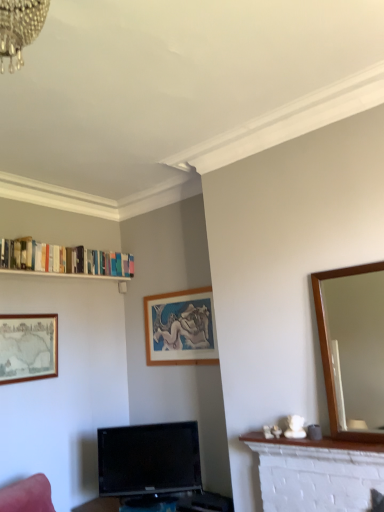
In order to face wooden picture frame at center, which is counted as the second picture frame, starting from the left, should I rotate leftwards or rightwards?

Rotate left and turn 1.717 degrees.

Find the location of a particular element. gold-framed map at left, the 2th picture frame when ordered from right to left is located at coordinates (28, 347).

Describe the element at coordinates (316, 473) in the screenshot. I see `white brick fireplace at lower right` at that location.

The height and width of the screenshot is (512, 384). Describe the element at coordinates (149, 461) in the screenshot. I see `black glossy tv at lower center` at that location.

Find the location of a particular element. wooden picture frame at center, marked as the 1th picture frame in a right-to-left arrangement is located at coordinates (180, 328).

Which is closer, [333,445] or [350,318]?

Point [333,445] is positioned closer to the camera compared to point [350,318].

Would you say white brick fireplace at lower right is inside or outside wooden mirror at right?

white brick fireplace at lower right cannot be found inside wooden mirror at right.

From the image's perspective, which is below, white brick fireplace at lower right or wooden mirror at right?

white brick fireplace at lower right.

Considering the sizes of objects white brick fireplace at lower right and wooden mirror at right in the image provided, who is thinner, white brick fireplace at lower right or wooden mirror at right?

wooden mirror at right is thinner.

Is gold-framed map at left, the first picture frame when ordered from left to right, far from white glossy bookshelf at upper left?

No, gold-framed map at left, the first picture frame when ordered from left to right, is in close proximity to white glossy bookshelf at upper left.

Measure the distance between gold-framed map at left, the first picture frame when ordered from left to right, and white glossy bookshelf at upper left.

gold-framed map at left, the first picture frame when ordered from left to right, is 50.08 centimeters away from white glossy bookshelf at upper left.

Can you confirm if gold-framed map at left, the first picture frame when ordered from left to right, is positioned to the left of white glossy bookshelf at upper left?

Yes, gold-framed map at left, the first picture frame when ordered from left to right, is to the left of white glossy bookshelf at upper left.

Which is further, (1,333) or (94,275)?

The point (94,275) is farther.

Which is less distant, (362,300) or (187,447)?

The point (362,300) is closer.

Can you confirm if wooden mirror at right is taller than black glossy tv at lower center?

Indeed, wooden mirror at right has a greater height compared to black glossy tv at lower center.

Are wooden mirror at right and black glossy tv at lower center located far from each other?

wooden mirror at right is positioned a significant distance from black glossy tv at lower center.

Is wooden mirror at right oriented away from black glossy tv at lower center?

No, black glossy tv at lower center is not at the back of wooden mirror at right.

Is point (292, 457) less distant than point (128, 464)?

Yes, point (292, 457) is closer to viewer.

Considering the positions of objects white brick fireplace at lower right and black glossy tv at lower center in the image provided, who is more to the left, white brick fireplace at lower right or black glossy tv at lower center?

black glossy tv at lower center.

Is white brick fireplace at lower right spatially inside black glossy tv at lower center, or outside of it?

The correct answer is: outside.

Is white brick fireplace at lower right wider or thinner than black glossy tv at lower center?

white brick fireplace at lower right is thinner than black glossy tv at lower center.

From the picture: Between wooden mirror at right and white glossy bookshelf at upper left, which one appears on the right side from the viewer's perspective?

From the viewer's perspective, wooden mirror at right appears more on the right side.

Can you confirm if wooden mirror at right is wider than white glossy bookshelf at upper left?

Incorrect, the width of wooden mirror at right does not surpass that of white glossy bookshelf at upper left.

In the scene shown: Can you tell me how much wooden mirror at right and white glossy bookshelf at upper left differ in facing direction?

The facing directions of wooden mirror at right and white glossy bookshelf at upper left are 90 degrees apart.

Is wooden mirror at right with white glossy bookshelf at upper left?

They are not placed beside each other.

Does wooden mirror at right come behind gold-framed map at left, the 2th picture frame when ordered from right to left?

No, it is in front of gold-framed map at left, the 2th picture frame when ordered from right to left.

I want to click on mirror that is above the gold-framed map at left, the first picture frame when ordered from left to right (from the image's perspective), so click(x=357, y=347).

Is wooden mirror at right next to gold-framed map at left, the first picture frame when ordered from left to right, and touching it?

No, wooden mirror at right is not making contact with gold-framed map at left, the first picture frame when ordered from left to right.

In the scene shown: Is wooden mirror at right to the left of gold-framed map at left, the first picture frame when ordered from left to right, from the viewer's perspective?

No.

Does wooden picture frame at center, which is counted as the second picture frame, starting from the left, appear on the left side of white brick fireplace at lower right?

Yes.

Consider the image. Relative to white brick fireplace at lower right, is wooden picture frame at center, marked as the 1th picture frame in a right-to-left arrangement, in front or behind?

In the image, wooden picture frame at center, marked as the 1th picture frame in a right-to-left arrangement, appears behind white brick fireplace at lower right.

Looking at this image, from a real-world perspective, is wooden picture frame at center, marked as the 1th picture frame in a right-to-left arrangement, physically located above or below white brick fireplace at lower right?

In terms of real-world spatial position, wooden picture frame at center, marked as the 1th picture frame in a right-to-left arrangement, is above white brick fireplace at lower right.

Locate an element on the screen. The image size is (384, 512). mirror in front of the white brick fireplace at lower right is located at coordinates (357, 347).

From the image's perspective, which picture frame is the 2nd one below the white glossy bookshelf at upper left? Please provide its 2D coordinates.

[(28, 347)]

Looking at the image, which one is located further to gold-framed map at left, the first picture frame when ordered from left to right, black glossy tv at lower center or white brick fireplace at lower right?

Among the two, white brick fireplace at lower right is located further to gold-framed map at left, the first picture frame when ordered from left to right.

Based on their spatial positions, is white glossy bookshelf at upper left or white brick fireplace at lower right further from wooden picture frame at center, marked as the 1th picture frame in a right-to-left arrangement?

Based on the image, white brick fireplace at lower right appears to be further to wooden picture frame at center, marked as the 1th picture frame in a right-to-left arrangement.

Based on their spatial positions, is gold-framed map at left, the first picture frame when ordered from left to right, or wooden mirror at right closer to wooden picture frame at center, which is counted as the second picture frame, starting from the left?

gold-framed map at left, the first picture frame when ordered from left to right, is positioned closer to the anchor wooden picture frame at center, which is counted as the second picture frame, starting from the left.

Estimate the real-world distances between objects in this image. Which object is further from black glossy tv at lower center, wooden mirror at right or gold-framed map at left, the 2th picture frame when ordered from right to left?

The object further to black glossy tv at lower center is wooden mirror at right.

Considering their positions, is wooden picture frame at center, which is counted as the second picture frame, starting from the left, positioned closer to wooden mirror at right than white brick fireplace at lower right?

white brick fireplace at lower right is positioned closer to the anchor wooden mirror at right.

Estimate the real-world distances between objects in this image. Which object is closer to gold-framed map at left, the first picture frame when ordered from left to right, wooden picture frame at center, marked as the 1th picture frame in a right-to-left arrangement, or black glossy tv at lower center?

Based on the image, black glossy tv at lower center appears to be nearer to gold-framed map at left, the first picture frame when ordered from left to right.

Looking at the image, which one is located further to black glossy tv at lower center, wooden picture frame at center, which is counted as the second picture frame, starting from the left, or white brick fireplace at lower right?

white brick fireplace at lower right is positioned further to the anchor black glossy tv at lower center.

When comparing their distances from wooden picture frame at center, which is counted as the second picture frame, starting from the left, does white glossy bookshelf at upper left or wooden mirror at right seem closer?

white glossy bookshelf at upper left.

In order to click on picture frame between gold-framed map at left, the 2th picture frame when ordered from right to left, and wooden mirror at right from left to right in this screenshot , I will do `click(180, 328)`.

Where is `fireplace located between white glossy bookshelf at upper left and wooden mirror at right in the left-right direction`? The image size is (384, 512). fireplace located between white glossy bookshelf at upper left and wooden mirror at right in the left-right direction is located at coordinates (316, 473).

At what (x,y) coordinates should I click in order to perform the action: click on fireplace between black glossy tv at lower center and wooden mirror at right from left to right. Please return your answer as a coordinate pair (x, y). This screenshot has width=384, height=512. Looking at the image, I should click on (x=316, y=473).

The width and height of the screenshot is (384, 512). In order to click on television between white brick fireplace at lower right and wooden picture frame at center, which is counted as the second picture frame, starting from the left, from front to back in this screenshot , I will do `click(149, 461)`.